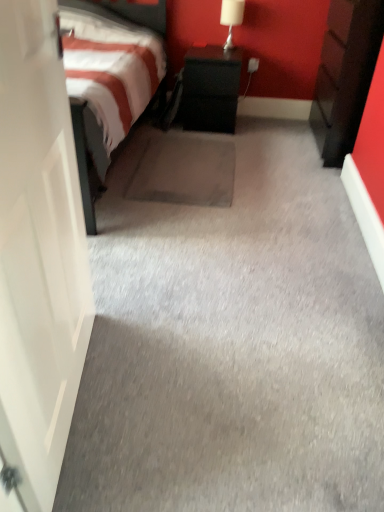
Question: Is dark wood nightstand at right, the second nightstand from the left, facing towards black matte nightstand at center, the second nightstand in the right-to-left sequence?

Choices:
 (A) no
 (B) yes

Answer: (B)

Question: Would you say dark wood nightstand at right, positioned as the 1th nightstand in right-to-left order, contains black matte nightstand at center, the second nightstand in the right-to-left sequence?

Choices:
 (A) yes
 (B) no

Answer: (B)

Question: From the image's perspective, is dark wood nightstand at right, the second nightstand from the left, on black matte nightstand at center, the 1th nightstand in the left-to-right sequence?

Choices:
 (A) no
 (B) yes

Answer: (A)

Question: Does dark wood nightstand at right, positioned as the 1th nightstand in right-to-left order, have a smaller size compared to black matte nightstand at center, the 1th nightstand in the left-to-right sequence?

Choices:
 (A) no
 (B) yes

Answer: (A)

Question: From a real-world perspective, is dark wood nightstand at right, the second nightstand from the left, under black matte nightstand at center, the 1th nightstand in the left-to-right sequence?

Choices:
 (A) no
 (B) yes

Answer: (A)

Question: From the image's perspective, is dark wood nightstand at right, positioned as the 1th nightstand in right-to-left order, under black matte nightstand at center, the second nightstand in the right-to-left sequence?

Choices:
 (A) no
 (B) yes

Answer: (B)

Question: Is black matte nightstand at center, the 1th nightstand in the left-to-right sequence, positioned far away from white glossy table lamp at upper right?

Choices:
 (A) no
 (B) yes

Answer: (A)

Question: Is black matte nightstand at center, the 1th nightstand in the left-to-right sequence, shorter than white glossy table lamp at upper right?

Choices:
 (A) no
 (B) yes

Answer: (A)

Question: Can you confirm if black matte nightstand at center, the 1th nightstand in the left-to-right sequence, is positioned to the right of white glossy table lamp at upper right?

Choices:
 (A) yes
 (B) no

Answer: (B)

Question: Does black matte nightstand at center, the 1th nightstand in the left-to-right sequence, touch white glossy table lamp at upper right?

Choices:
 (A) no
 (B) yes

Answer: (A)

Question: Is black matte nightstand at center, the 1th nightstand in the left-to-right sequence, aimed at white glossy table lamp at upper right?

Choices:
 (A) yes
 (B) no

Answer: (B)

Question: From the image's perspective, is black matte nightstand at center, the 1th nightstand in the left-to-right sequence, on top of white glossy table lamp at upper right?

Choices:
 (A) no
 (B) yes

Answer: (A)

Question: From the image's perspective, would you say black matte nightstand at center, the 1th nightstand in the left-to-right sequence, is shown under dark wood nightstand at right, the second nightstand from the left?

Choices:
 (A) yes
 (B) no

Answer: (B)